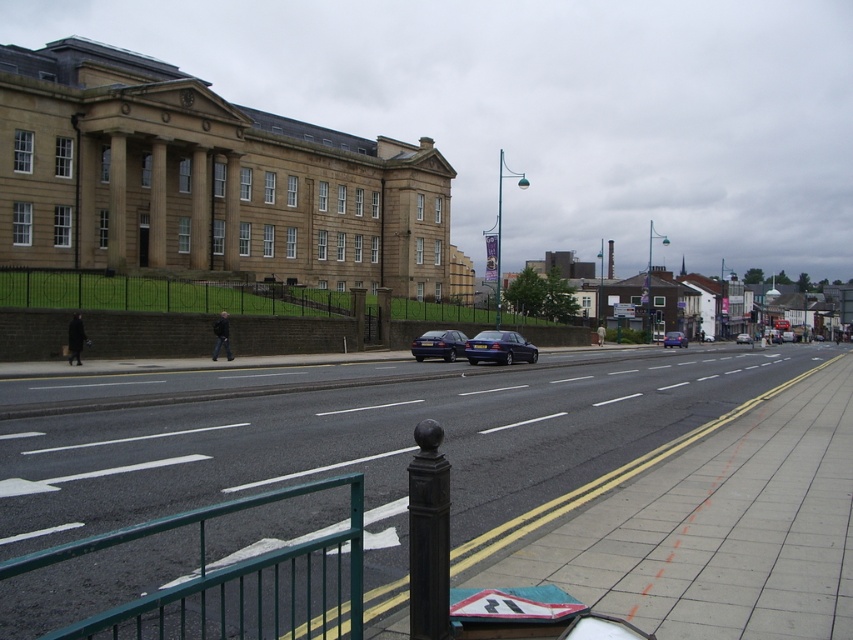
Question: Does metallic blue sedan at center appear over blue metallic sedan at center?

Choices:
 (A) no
 (B) yes

Answer: (A)

Question: Which point is farther from the camera taking this photo?

Choices:
 (A) (456, 333)
 (B) (486, 589)
 (C) (668, 243)
 (D) (473, 346)

Answer: (C)

Question: Does smooth concrete pavement at center have a greater width compared to metallic streetlight at upper center?

Choices:
 (A) yes
 (B) no

Answer: (B)

Question: Which point is closer to the camera?

Choices:
 (A) reflective plastic sign at lower center
 (B) satin blue sedan at center

Answer: (A)

Question: Is reflective plastic sign at lower center to the left of matte dark blue sedan at center from the viewer's perspective?

Choices:
 (A) no
 (B) yes

Answer: (A)

Question: Which object is the closest to the matte blue car at center?

Choices:
 (A) metallic streetlight at upper center
 (B) matte dark blue sedan at center
 (C) satin blue sedan at center
 (D) blue metallic sedan at center

Answer: (D)